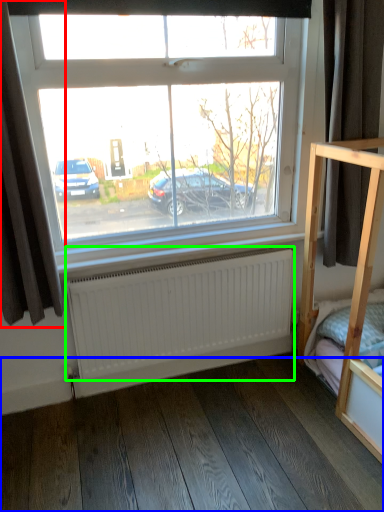
Question: Which is nearer to the curtain (highlighted by a red box)? hardwood (highlighted by a blue box) or radiator (highlighted by a green box).

Choices:
 (A) hardwood
 (B) radiator

Answer: (B)